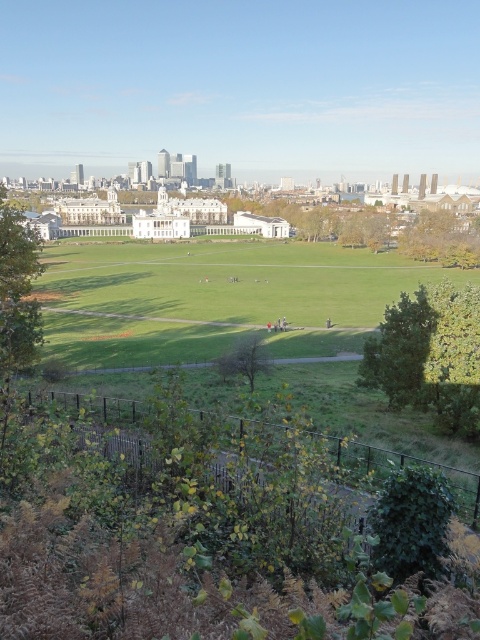
Question: Based on their relative distances, which object is nearer to the green leafy tree at upper right?

Choices:
 (A) green grassy field at center
 (B) green leafy tree at center

Answer: (A)

Question: Can you confirm if green leafy tree at lower left is thinner than green leafy tree at upper right?

Choices:
 (A) yes
 (B) no

Answer: (A)

Question: Does green grassy field at center have a larger size compared to green leafy tree at center?

Choices:
 (A) no
 (B) yes

Answer: (B)

Question: Does green leafy tree at center-right appear over green leafy tree at lower left?

Choices:
 (A) yes
 (B) no

Answer: (B)

Question: Which of the following is the closest to the observer?

Choices:
 (A) (112, 348)
 (B) (240, 371)
 (C) (472, 250)

Answer: (B)

Question: Which object appears farthest from the camera in this image?

Choices:
 (A) green leafy tree at upper right
 (B) green grassy field at center
 (C) green leafy tree at center

Answer: (A)